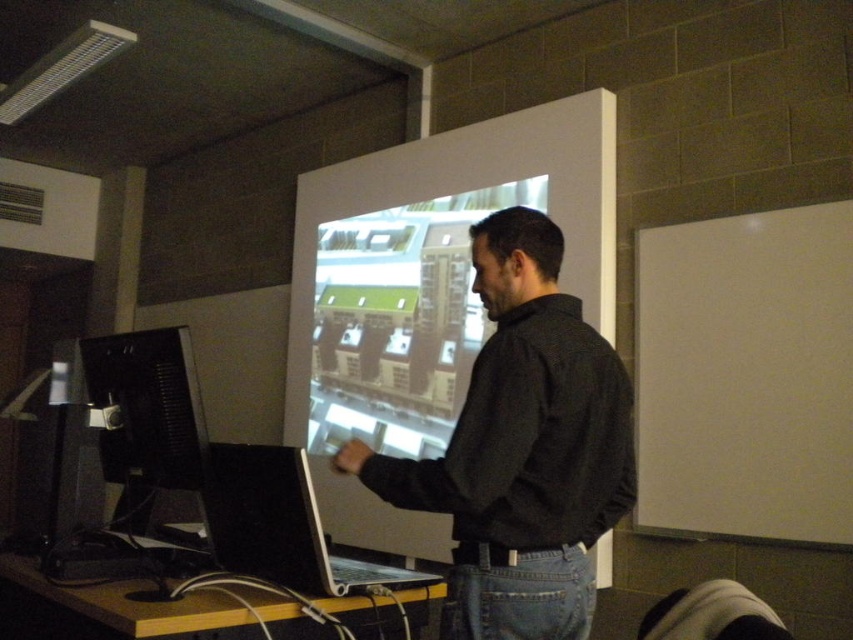
You are a technician standing in front of the matte glass projection screen at center. You need to adjust the focus of the projector, which requires you to be exactly 9 feet away from the screen. Can you do this adjustment from your current position?

The matte glass projection screen at center is 9.19 feet away from camera. Since you are standing in front of it, your current distance is approximately 9.19 feet, which is slightly more than 9 feet. Therefore, you need to move 0.19 feet closer to reach the required distance for adjusting the focus.

You are a guest attending a presentation and see the black matte shirt at center and the matte glass projection screen at center. Which object is closer to the floor?

The black matte shirt at center is located below the matte glass projection screen at center, so it is closer to the floor than the screen.